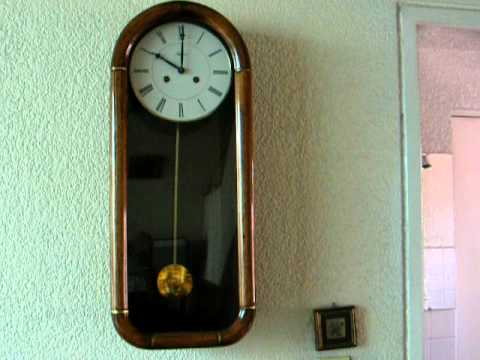
This screenshot has height=360, width=480. Identify the location of door frame. (408, 323).